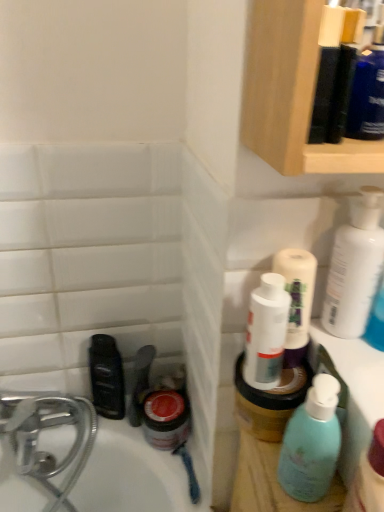
Where is `black plastic mouthwash at lower left`? black plastic mouthwash at lower left is located at coordinates (107, 377).

Is black plastic mouthwash at lower left beside teal matte bottle at right?

No, black plastic mouthwash at lower left is not making contact with teal matte bottle at right.

Can you confirm if black plastic mouthwash at lower left is shorter than teal matte bottle at right?

Indeed, black plastic mouthwash at lower left has a lesser height compared to teal matte bottle at right.

Is black plastic mouthwash at lower left further to camera compared to teal matte bottle at right?

Yes.

Is white glossy lotion at upper right in contact with black plastic mouthwash at lower left?

No.

Where is `cleaning product above the black plastic mouthwash at lower left (from the image's perspective)`? The width and height of the screenshot is (384, 512). cleaning product above the black plastic mouthwash at lower left (from the image's perspective) is located at coordinates pos(355,267).

Consider the image. Considering the sizes of objects white glossy lotion at upper right and black plastic mouthwash at lower left in the image provided, who is thinner, white glossy lotion at upper right or black plastic mouthwash at lower left?

black plastic mouthwash at lower left is thinner.

Could black plastic mouthwash at lower left be considered to be inside white glossy lotion at upper right?

No, white glossy lotion at upper right does not contain black plastic mouthwash at lower left.

Between teal matte bottle at right and white glossy lotion at upper right, which one has smaller width?

teal matte bottle at right.

Based on their positions, is teal matte bottle at right located to the left or right of white glossy lotion at upper right?

teal matte bottle at right is positioned on white glossy lotion at upper right's left side.

Can you confirm if teal matte bottle at right is taller than white glossy lotion at upper right?

Yes.

Considering the positions of point (293, 472) and point (373, 267), is point (293, 472) closer or farther from the camera than point (373, 267)?

Point (293, 472) appears to be closer to the viewer than point (373, 267).

What's the angular difference between teal matte bottle at right and black plastic mouthwash at lower left's facing directions?

There is a 21.9-degree angle between the facing directions of teal matte bottle at right and black plastic mouthwash at lower left.

Is point (307, 466) closer or farther from the camera than point (95, 357)?

Point (307, 466).

Relative to black plastic mouthwash at lower left, is teal matte bottle at right in front or behind?

Visually, teal matte bottle at right is located in front of black plastic mouthwash at lower left.

Measure the distance between teal matte bottle at right and black plastic mouthwash at lower left.

teal matte bottle at right is 21.90 inches away from black plastic mouthwash at lower left.

Is black plastic mouthwash at lower left not near white glossy lotion at upper right?

No, there isn't a large distance between black plastic mouthwash at lower left and white glossy lotion at upper right.

Does point (109, 399) come farther from viewer compared to point (375, 268)?

That is True.

Image resolution: width=384 pixels, height=512 pixels. In the image, there is a white glossy lotion at upper right. Find the location of `mouthwash below it (from the image's perspective)`. mouthwash below it (from the image's perspective) is located at coordinates (107, 377).

Would you say white glossy lotion at upper right is outside teal matte bottle at right?

Yes, white glossy lotion at upper right is outside of teal matte bottle at right.

Considering the relative sizes of white glossy lotion at upper right and teal matte bottle at right in the image provided, is white glossy lotion at upper right shorter than teal matte bottle at right?

Correct, white glossy lotion at upper right is not as tall as teal matte bottle at right.

Which point is more forward, (368, 207) or (327, 407)?

Point (327, 407)

Identify the location of bottle that is below the white glossy lotion at upper right (from the image's perspective). The image size is (384, 512). (311, 443).

The image size is (384, 512). In order to click on mouthwash behind the teal matte bottle at right in this screenshot , I will do `click(107, 377)`.

Where is `cleaning product on the right of black plastic mouthwash at lower left`? The height and width of the screenshot is (512, 384). cleaning product on the right of black plastic mouthwash at lower left is located at coordinates (355, 267).

When comparing their distances from teal matte bottle at right, does white glossy lotion at upper right or black plastic mouthwash at lower left seem further?

black plastic mouthwash at lower left lies further to teal matte bottle at right than the other object.

Which object lies nearer to the anchor point white glossy lotion at upper right, black plastic mouthwash at lower left or teal matte bottle at right?

teal matte bottle at right lies closer to white glossy lotion at upper right than the other object.

From the image, which object appears to be farther from black plastic mouthwash at lower left, teal matte bottle at right or white glossy lotion at upper right?

white glossy lotion at upper right lies further to black plastic mouthwash at lower left than the other object.

Estimate the real-world distances between objects in this image. Which object is further from white glossy lotion at upper right, teal matte bottle at right or black plastic mouthwash at lower left?

black plastic mouthwash at lower left is further to white glossy lotion at upper right.

In the scene shown: Looking at the image, which one is located further to teal matte bottle at right, black plastic mouthwash at lower left or white glossy lotion at upper right?

The object further to teal matte bottle at right is black plastic mouthwash at lower left.

Looking at the image, which one is located further to black plastic mouthwash at lower left, white glossy lotion at upper right or teal matte bottle at right?

white glossy lotion at upper right.

Where is `cleaning product positioned between teal matte bottle at right and black plastic mouthwash at lower left from near to far`? The width and height of the screenshot is (384, 512). cleaning product positioned between teal matte bottle at right and black plastic mouthwash at lower left from near to far is located at coordinates (355, 267).